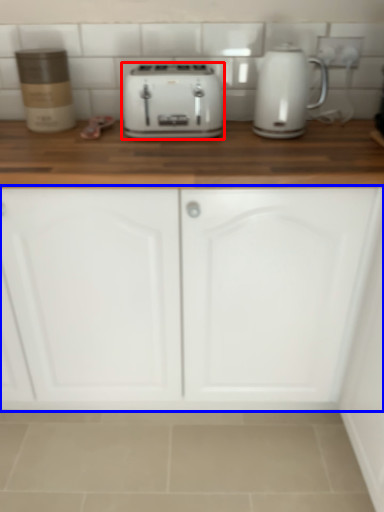
Question: Which object is further to the camera taking this photo, toaster (highlighted by a red box) or cabinetry (highlighted by a blue box)?

Choices:
 (A) toaster
 (B) cabinetry

Answer: (A)